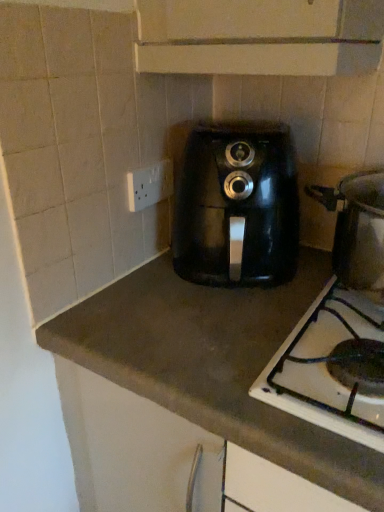
What are the coordinates of `free location in front of black plastic air fryer at center` in the screenshot? It's located at (190, 334).